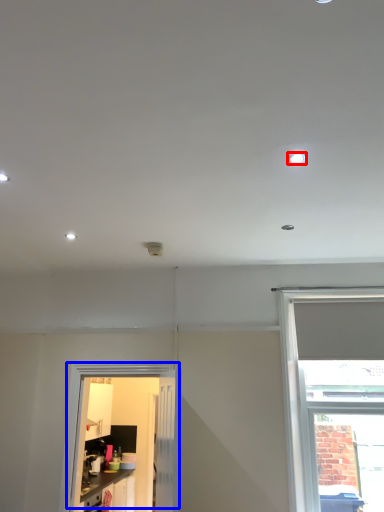
Question: Which object is closer to the camera taking this photo, lighting (highlighted by a red box) or door (highlighted by a blue box)?

Choices:
 (A) lighting
 (B) door

Answer: (A)